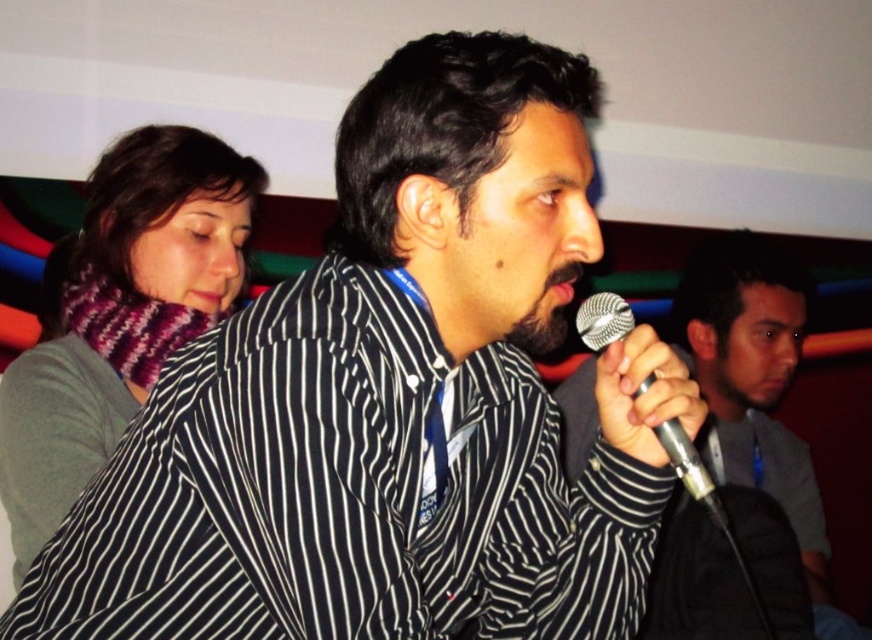
You are organizing a conference and need to choose between the black matte microphone at center and the silver metallic microphone at center for a speaker who prefers a wider grip. Which microphone should you select?

The black matte microphone at center has a greater width than the silver metallic microphone at center, so it would provide a wider grip for the speaker.

You are standing at the center of the image. There is a point marked at coordinates (119, 314). What object is located at that point?

The point at coordinates (119, 314) marks the knitted wool scarf at upper left.

You are standing at point (584,321) and want to move to point (703,428). Is the path directly ahead of you clear? Please explain using the scene details.

Point (703,428) is behind point (584,321), so moving directly ahead from your current position would not reach the target point. You need to adjust your direction to move backward or sideways to reach it.